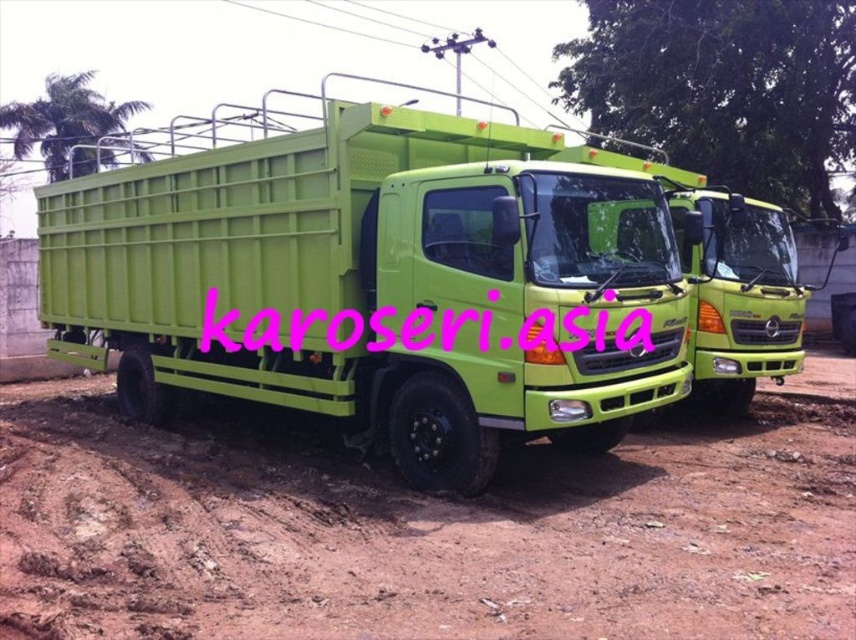
Question: Can you confirm if lime green plastic truck at center is wider than brown dirt track at lower center?

Choices:
 (A) yes
 (B) no

Answer: (B)

Question: Does lime green plastic truck at center have a greater width compared to brown dirt track at lower center?

Choices:
 (A) yes
 (B) no

Answer: (B)

Question: Does lime green plastic truck at center have a lesser width compared to brown dirt track at lower center?

Choices:
 (A) no
 (B) yes

Answer: (B)

Question: Which object appears farthest from the camera in this image?

Choices:
 (A) brown dirt track at lower center
 (B) lime green plastic truck at center

Answer: (B)

Question: Among these objects, which one is farthest from the camera?

Choices:
 (A) lime green plastic truck at center
 (B) brown dirt track at lower center

Answer: (A)